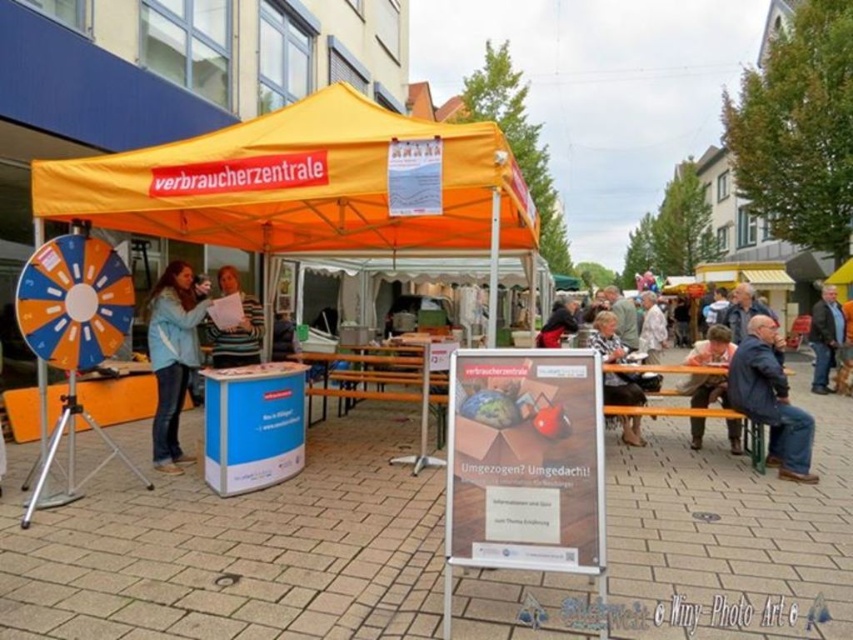
You are at the event and want to take a photo of the blue denim jacket at lower right without moving any objects. Where should you position yourself to capture it in the frame?

To capture the blue denim jacket at lower right in your photo, position yourself so that the jacket is located at the coordinates corresponding to point 0.625 on the horizontal axis and 0.904 on the vertical axis within the frame.

You are standing at the point labeled point at (169, 445). You want to walk to the nearest building. The nearest building is 6 meters away. Can you reach it without crossing any obstacles?

The distance between you and the nearest building is 6 meters, which is greater than the 5.91 meters between you and the point labeled point at 0.698. Therefore, you cannot reach the nearest building without crossing any obstacles.